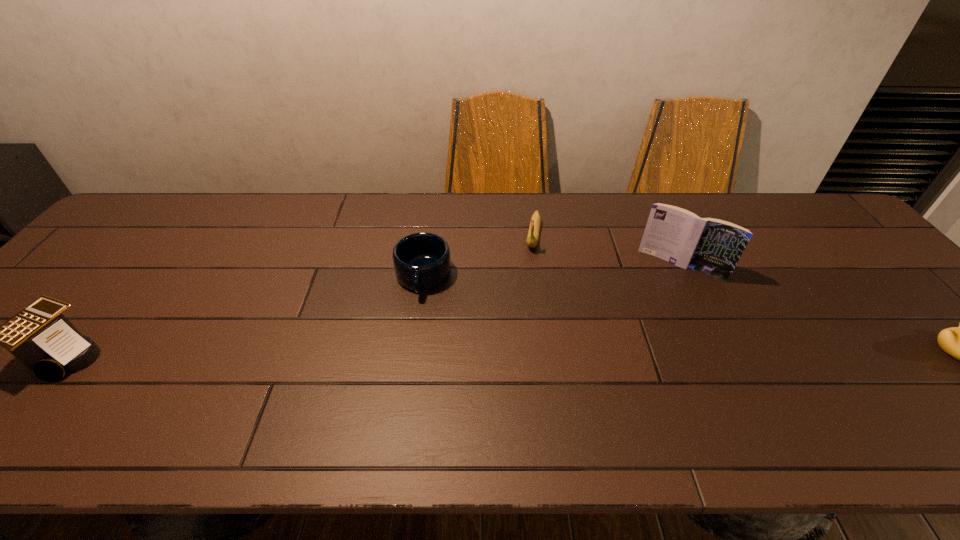
Where is `vacant region that satisfies the following two spatial constraints: 1. on the back side of the mug; 2. on the right side of the tallest object`? This screenshot has width=960, height=540. vacant region that satisfies the following two spatial constraints: 1. on the back side of the mug; 2. on the right side of the tallest object is located at coordinates (425, 266).